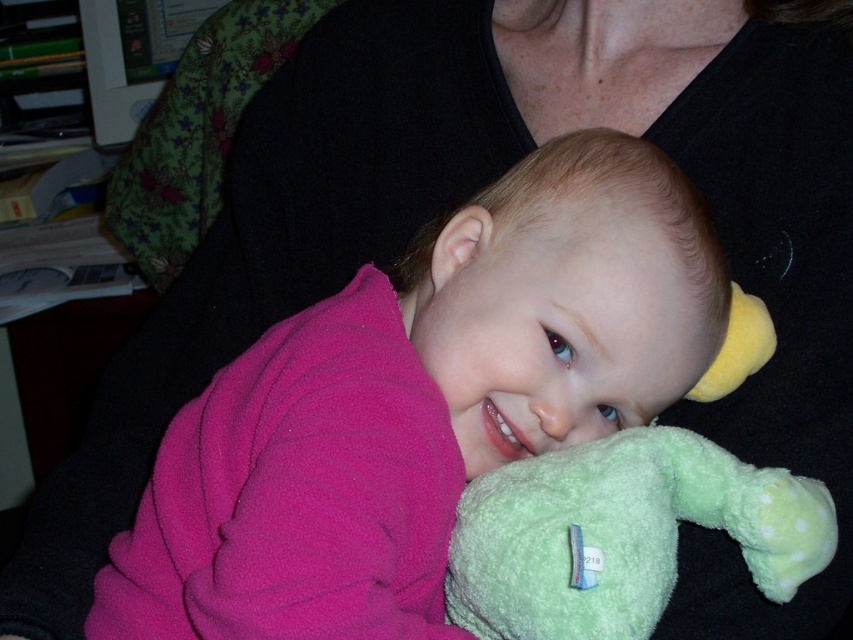
Question: Is pink fleece baby at center behind green plush toy at lower right?

Choices:
 (A) yes
 (B) no

Answer: (B)

Question: Which object is closer to the camera taking this photo?

Choices:
 (A) green plush toy at lower right
 (B) pink fleece baby at center

Answer: (B)

Question: Can you confirm if pink fleece baby at center is positioned to the right of green plush toy at lower right?

Choices:
 (A) yes
 (B) no

Answer: (B)

Question: Which object is farther from the camera taking this photo?

Choices:
 (A) pink fleece baby at center
 (B) green plush toy at lower right

Answer: (B)

Question: Is pink fleece baby at center bigger than green plush toy at lower right?

Choices:
 (A) no
 (B) yes

Answer: (B)

Question: Which point appears closest to the camera in this image?

Choices:
 (A) (346, 595)
 (B) (769, 531)

Answer: (A)